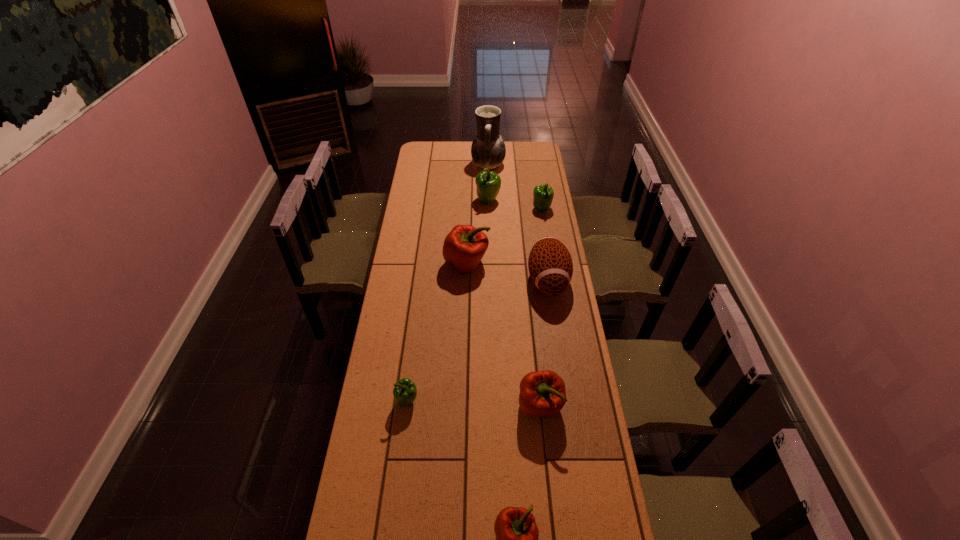
You are a GUI agent. You are given a task and a screenshot of the screen. Output one action in this format:
    pyautogui.click(x=<x>, y=<y>)
    Task: Click on the free space located on the front-facing side of the tallest object
    
    Given the screenshot: What is the action you would take?
    pyautogui.click(x=444, y=165)

The image size is (960, 540). Identify the location of free space located 0.090m on the front-facing side of the tallest object. (456, 165).

The height and width of the screenshot is (540, 960). What are the coordinates of `vacant space located 0.210m on the front-facing side of the tallest object` in the screenshot? It's located at (437, 165).

Locate an element on the screen. This screenshot has height=540, width=960. free space located on the back of the biggest green bell pepper is located at coordinates (487, 156).

The image size is (960, 540). In order to click on free space located on the back of the biggest pink bell pepper in this screenshot , I will do `click(468, 209)`.

I want to click on vacant region located 0.100m on the front of the football, so click(555, 328).

The image size is (960, 540). Identify the location of vacant space located on the left of the second smallest green bell pepper. (468, 208).

At what (x,y) coordinates should I click in order to perform the action: click on free space located 0.140m on the front of the second nearest pink bell pepper. Please return your answer as a coordinate pair (x, y). Looking at the image, I should click on (546, 470).

Identify the location of vacant space positioned on the back of the nearest green bell pepper. The image size is (960, 540). (419, 310).

Where is `object that is at the far edge`? The width and height of the screenshot is (960, 540). object that is at the far edge is located at coordinates (488, 150).